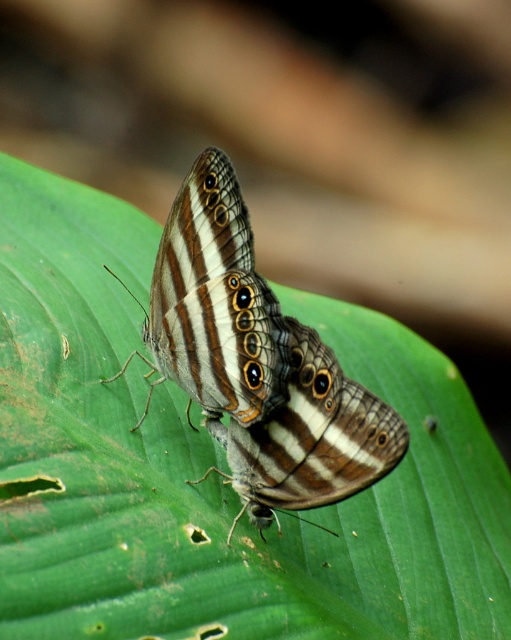
Between shiny brown butterfly at center and brown striped butterfly at center, which one is positioned lower?

brown striped butterfly at center is below.

Between shiny brown butterfly at center and brown striped butterfly at center, which one appears on the left side from the viewer's perspective?

shiny brown butterfly at center

Locate an element on the screen. This screenshot has height=640, width=511. shiny brown butterfly at center is located at coordinates (214, 301).

Locate an element on the screen. The height and width of the screenshot is (640, 511). shiny brown butterfly at center is located at coordinates (214, 301).